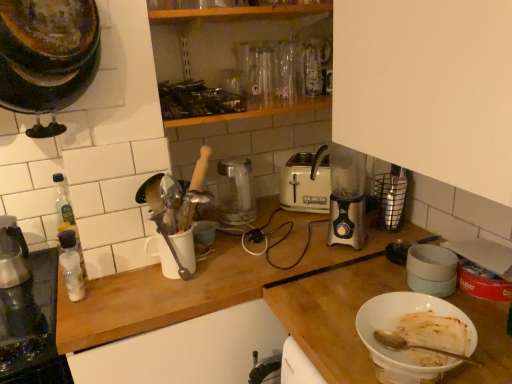
Where is `free space in front of satin silver kettle at center, which appears as the 2th kitchen appliance when viewed from the right`? This screenshot has width=512, height=384. free space in front of satin silver kettle at center, which appears as the 2th kitchen appliance when viewed from the right is located at coordinates (247, 237).